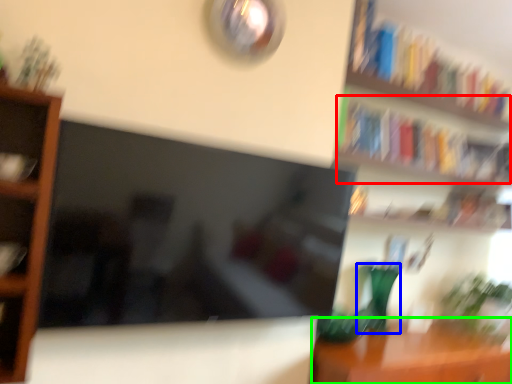
Question: Estimate the real-world distances between objects in this image. Which object is closer to book (highlighted by a red box), glass vase (highlighted by a blue box) or table (highlighted by a green box)?

Choices:
 (A) glass vase
 (B) table

Answer: (A)